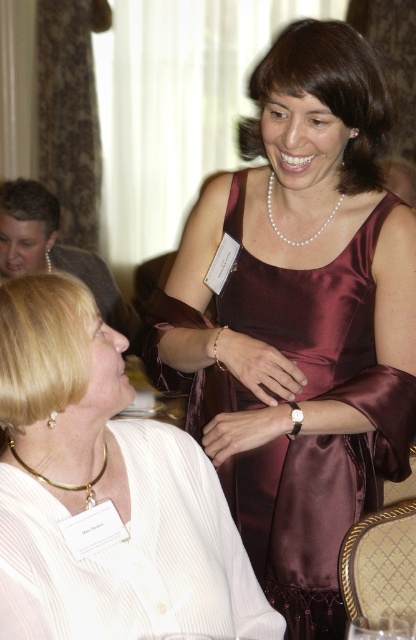
Between burgundy satin dress at center and matte gold necklace at upper left, which one has more height?

Standing taller between the two is burgundy satin dress at center.

Who is shorter, burgundy satin dress at center or matte gold necklace at upper left?

Standing shorter between the two is matte gold necklace at upper left.

Is point (220, 326) closer to viewer compared to point (44, 204)?

Yes, it is.

Identify the location of burgundy satin dress at center. This screenshot has height=640, width=416. pyautogui.click(x=299, y=321).

Does matte gold necklace at upper left have a lesser width compared to pearl necklace at upper center?

No.

Does matte gold necklace at upper left appear on the left side of pearl necklace at upper center?

Correct, you'll find matte gold necklace at upper left to the left of pearl necklace at upper center.

You are a GUI agent. You are given a task and a screenshot of the screen. Output one action in this format:
    pyautogui.click(x=<x>, y=<y>)
    Task: Click on the matte gold necklace at upper left
    Image resolution: width=416 pixels, height=640 pixels.
    Given the screenshot: What is the action you would take?
    pyautogui.click(x=54, y=250)

Find the location of `burgundy satin dress at center`. burgundy satin dress at center is located at coordinates (299, 321).

Who is taller, burgundy satin dress at center or pearl necklace at upper center?

Standing taller between the two is burgundy satin dress at center.

Who is more forward, (364, 124) or (269, 177)?

Positioned in front is point (364, 124).

Where is `burgundy satin dress at center`? burgundy satin dress at center is located at coordinates (299, 321).